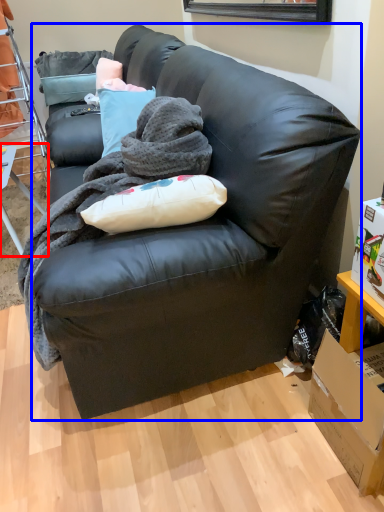
Question: Which object is closer to the camera taking this photo, table (highlighted by a red box) or studio couch (highlighted by a blue box)?

Choices:
 (A) table
 (B) studio couch

Answer: (B)